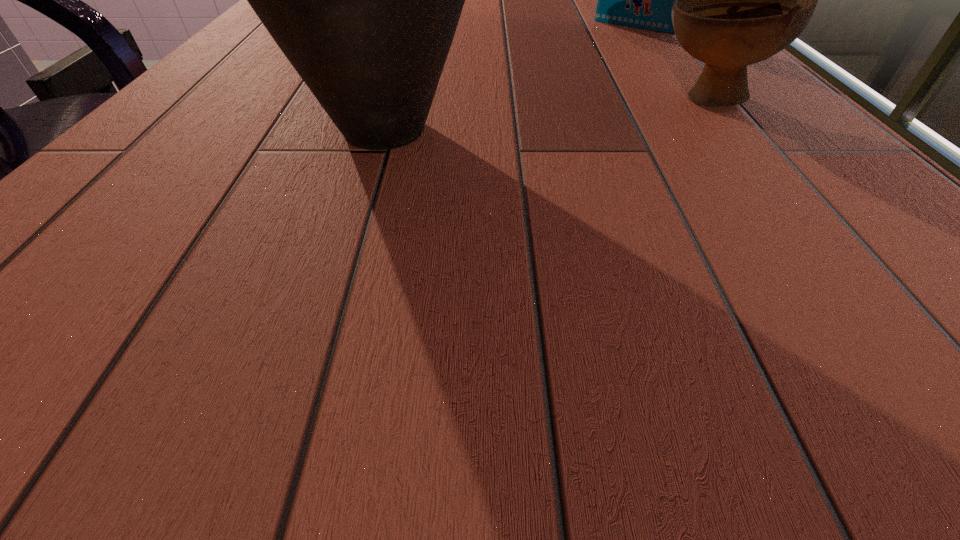
This screenshot has height=540, width=960. Identify the location of soup bowl that is at the right edge. (740, 0).

I want to click on book that is at the right edge, so click(x=644, y=0).

In the image, there is a desktop. At what (x,y) coordinates should I click in order to perform the action: click on vacant space at the left edge. Please return your answer as a coordinate pair (x, y). The image size is (960, 540). Looking at the image, I should click on (108, 190).

What are the coordinates of `empty location between the leftmost object and the book` in the screenshot? It's located at (509, 78).

Image resolution: width=960 pixels, height=540 pixels. Find the location of `free space between the leftmost object and the second tallest object`. free space between the leftmost object and the second tallest object is located at coordinates (509, 78).

Where is `blank region between the shortest object and the second shortest object`? The width and height of the screenshot is (960, 540). blank region between the shortest object and the second shortest object is located at coordinates (670, 63).

This screenshot has width=960, height=540. I want to click on empty location between the shortest object and the leftmost object, so click(x=545, y=114).

The image size is (960, 540). I want to click on free spot between the book and the urn, so click(509, 78).

At what (x,y) coordinates should I click in order to perform the action: click on object that is the second closest to the book. Please return your answer as a coordinate pair (x, y). Looking at the image, I should click on (364, 0).

Locate an element on the screen. This screenshot has width=960, height=540. object that can be found as the second closest to the leftmost object is located at coordinates (644, 0).